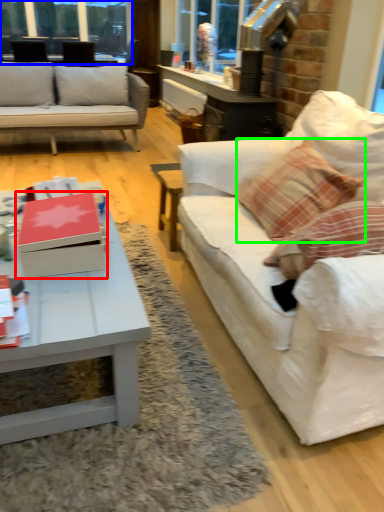
Question: Based on their relative distances, which object is nearer to box (highlighted by a red box)? Choose from window frame (highlighted by a blue box) and throw pillow (highlighted by a green box).

Choices:
 (A) window frame
 (B) throw pillow

Answer: (B)